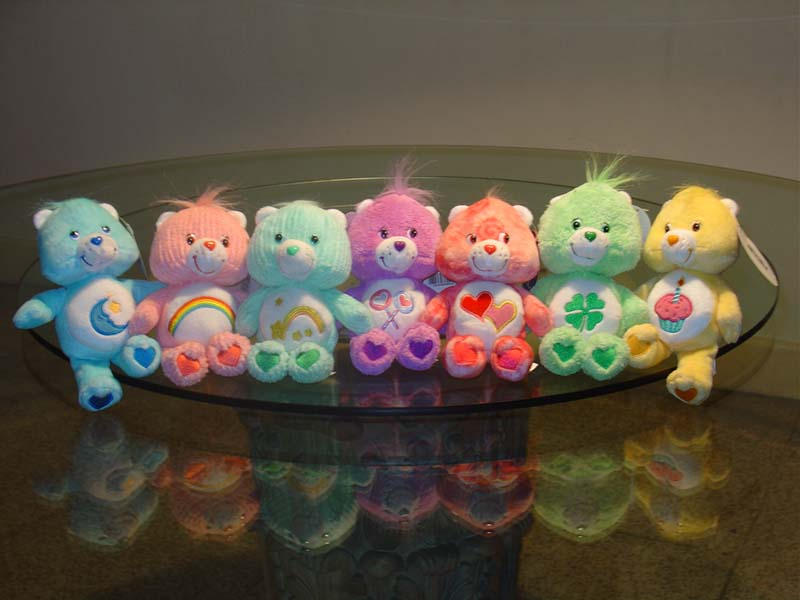
The image size is (800, 600). In order to click on mint green stuffed bear in this screenshot , I will do `click(294, 216)`.